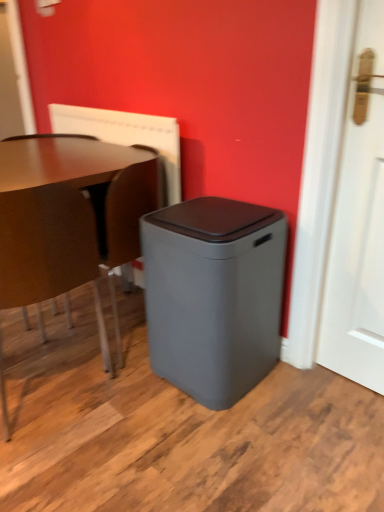
Question: Considering the relative sizes of brown leather swivel chair at lower left and white textured radiator at upper center in the image provided, is brown leather swivel chair at lower left smaller than white textured radiator at upper center?

Choices:
 (A) no
 (B) yes

Answer: (A)

Question: Is brown leather swivel chair at lower left behind white textured radiator at upper center?

Choices:
 (A) no
 (B) yes

Answer: (A)

Question: Considering the relative sizes of brown leather swivel chair at lower left and white textured radiator at upper center in the image provided, is brown leather swivel chair at lower left bigger than white textured radiator at upper center?

Choices:
 (A) yes
 (B) no

Answer: (A)

Question: Does brown leather swivel chair at lower left have a lesser width compared to white textured radiator at upper center?

Choices:
 (A) no
 (B) yes

Answer: (A)

Question: Could you tell me if brown leather swivel chair at lower left is facing white textured radiator at upper center?

Choices:
 (A) no
 (B) yes

Answer: (A)

Question: Based on their positions, is matte brown chair at left located to the left or right of gray matte waste container at center?

Choices:
 (A) left
 (B) right

Answer: (A)

Question: Is matte brown chair at left inside the boundaries of gray matte waste container at center, or outside?

Choices:
 (A) inside
 (B) outside

Answer: (B)

Question: From the image's perspective, is matte brown chair at left positioned above or below gray matte waste container at center?

Choices:
 (A) above
 (B) below

Answer: (A)

Question: Is matte brown chair at left in front of or behind gray matte waste container at center in the image?

Choices:
 (A) behind
 (B) front

Answer: (B)

Question: From a real-world perspective, is gray matte waste container at center above or below white textured radiator at upper center?

Choices:
 (A) below
 (B) above

Answer: (A)

Question: Looking at their shapes, would you say gray matte waste container at center is wider or thinner than white textured radiator at upper center?

Choices:
 (A) thin
 (B) wide

Answer: (B)

Question: Considering the relative positions of gray matte waste container at center and white textured radiator at upper center in the image provided, is gray matte waste container at center to the left or to the right of white textured radiator at upper center?

Choices:
 (A) left
 (B) right

Answer: (B)

Question: Does point (221, 335) appear closer or farther from the camera than point (177, 173)?

Choices:
 (A) closer
 (B) farther

Answer: (A)

Question: Is gray matte waste container at center bigger or smaller than matte brown chair at left?

Choices:
 (A) big
 (B) small

Answer: (B)

Question: Is gray matte waste container at center taller or shorter than matte brown chair at left?

Choices:
 (A) short
 (B) tall

Answer: (A)